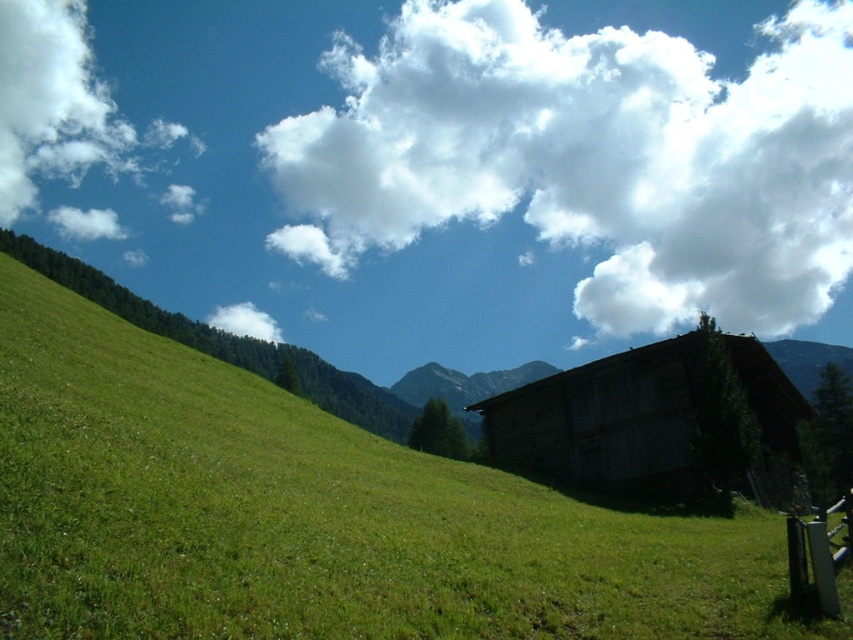
You are an architect designing a new eco friendly building. You observe the white fluffy cloud at upper center and the weathered wood barn at lower right in the scene. Which object has a greater width?

The white fluffy cloud at upper center has a greater width than the weathered wood barn at lower right.

Looking at this image, you are standing at the bottom of the green grassy at lower left and want to look up at the white fluffy cloud at upper center. Is the cloud above or below the grassy area?

The white fluffy cloud at upper center is above the green grassy at lower left, so the cloud is above the grassy area.

You are standing on the green grassy at lower left and looking up at the white fluffy cloud at upper center. Which object appears larger in your view?

The white fluffy cloud at upper center appears larger in your view because it is bigger than the green grassy at lower left.